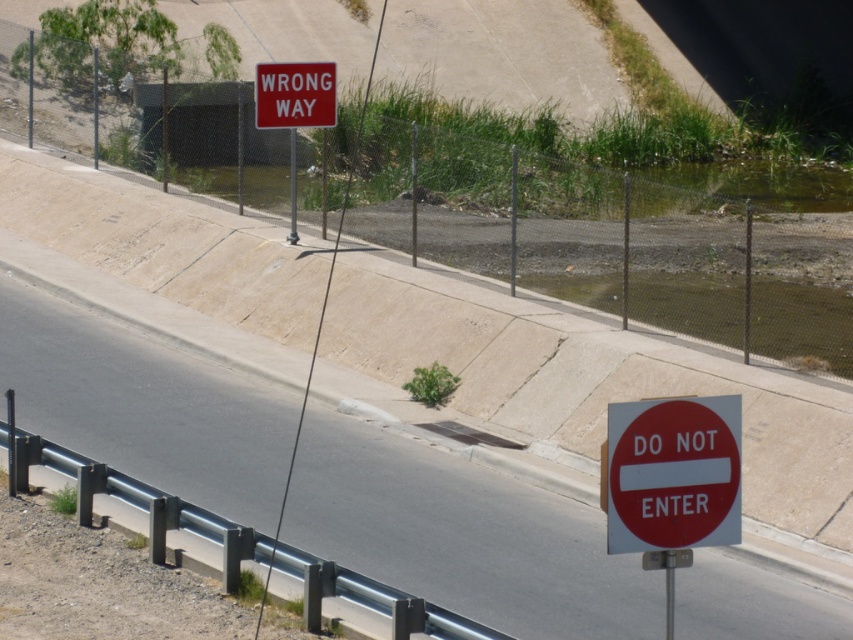
You are a driver approaching the intersection and see the red matte do not enter sign at lower right and the red matte sign at upper center. Which sign is closer to you?

The red matte do not enter sign at lower right is closer to you because it is in the foreground, while the red matte sign at upper center is positioned further back.

Consider the image. You are a delivery driver approaching the road with two traffic signs. You need to know which sign is wider to decide which lane to take. Which one is wider between the red plastic sign at right and the red matte sign at upper center?

The red plastic sign at right is wider than the red matte sign at upper center.